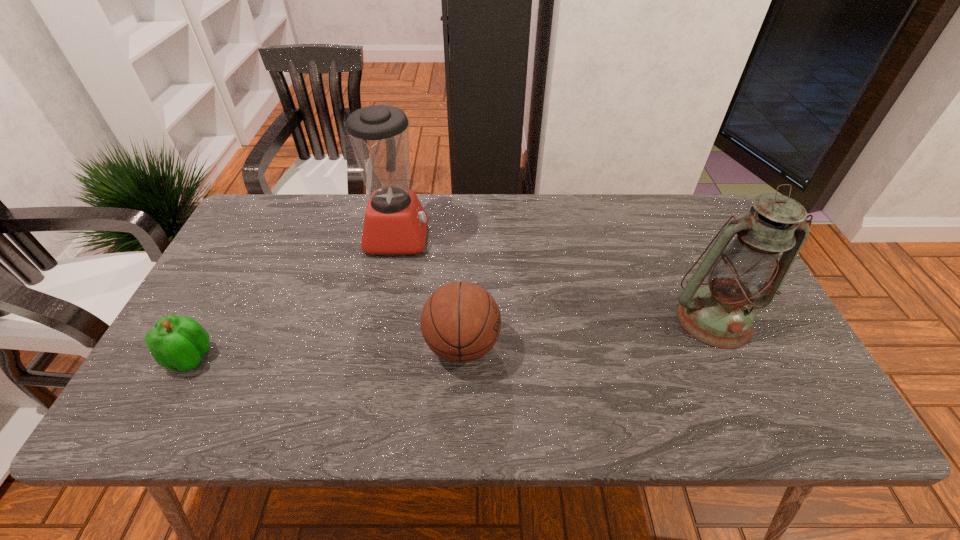
You are a GUI agent. You are given a task and a screenshot of the screen. Output one action in this format:
    pyautogui.click(x=<x>, y=<y>)
    Task: Click on the free location at the far right corner of the desktop
    
    Given the screenshot: What is the action you would take?
    pyautogui.click(x=706, y=210)

This screenshot has height=540, width=960. What are the coordinates of `unoccupied position between the rightmost object and the basketball` in the screenshot? It's located at (588, 332).

Locate an element on the screen. vacant point located between the farthest object and the oil lamp is located at coordinates (556, 278).

Where is `vacant point located between the oil lamp and the third object from right to left`? vacant point located between the oil lamp and the third object from right to left is located at coordinates (556, 278).

The image size is (960, 540). I want to click on vacant region between the leftmost object and the third tallest object, so click(326, 351).

At what (x,y) coordinates should I click in order to perform the action: click on vacant area between the second object from left to right and the bell pepper. Please return your answer as a coordinate pair (x, y). The height and width of the screenshot is (540, 960). Looking at the image, I should click on (294, 297).

Where is `vacant space that is in between the third tallest object and the oil lamp`? vacant space that is in between the third tallest object and the oil lamp is located at coordinates (588, 332).

Locate an element on the screen. empty location between the blender and the shortest object is located at coordinates (294, 297).

The height and width of the screenshot is (540, 960). I want to click on vacant area that lies between the third object from left to right and the farthest object, so click(x=430, y=291).

Locate which object ranks second in proximity to the rightmost object. Please provide its 2D coordinates. Your answer should be formatted as a tuple, i.e. [(x, y)], where the tuple contains the x and y coordinates of a point satisfying the conditions above.

[(395, 222)]